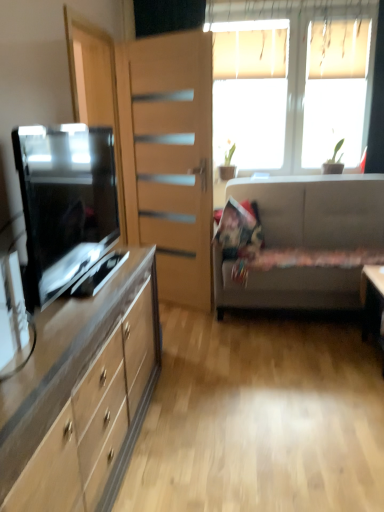
Question: In the image, is matte wood cabinet at left on the left side or the right side of matte wood file cabinet at left?

Choices:
 (A) right
 (B) left

Answer: (B)

Question: Relative to matte wood file cabinet at left, is matte wood cabinet at left in front or behind?

Choices:
 (A) front
 (B) behind

Answer: (A)

Question: Which object is positioned farthest from the white fabric couch at right?

Choices:
 (A) matte wood file cabinet at left
 (B) matte black tv at left
 (C) matte wood cabinet at left
 (D) green matte plant at upper center
 (E) fluffy fabric pillow at center

Answer: (C)

Question: Which is farther from the matte black tv at left?

Choices:
 (A) matte wood cabinet at left
 (B) white fabric couch at right
 (C) matte wood file cabinet at left
 (D) green matte plant at upper center
 (E) fluffy fabric pillow at center

Answer: (D)